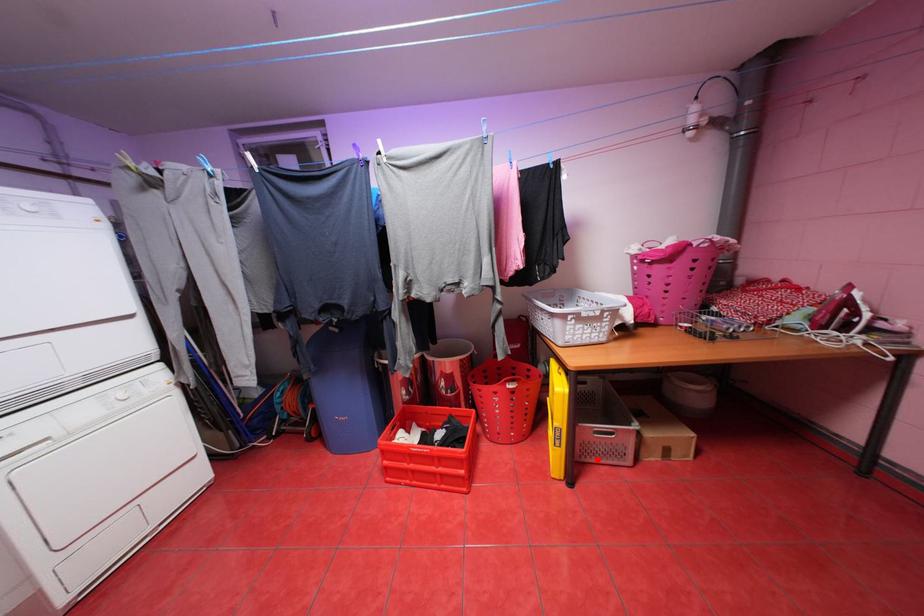
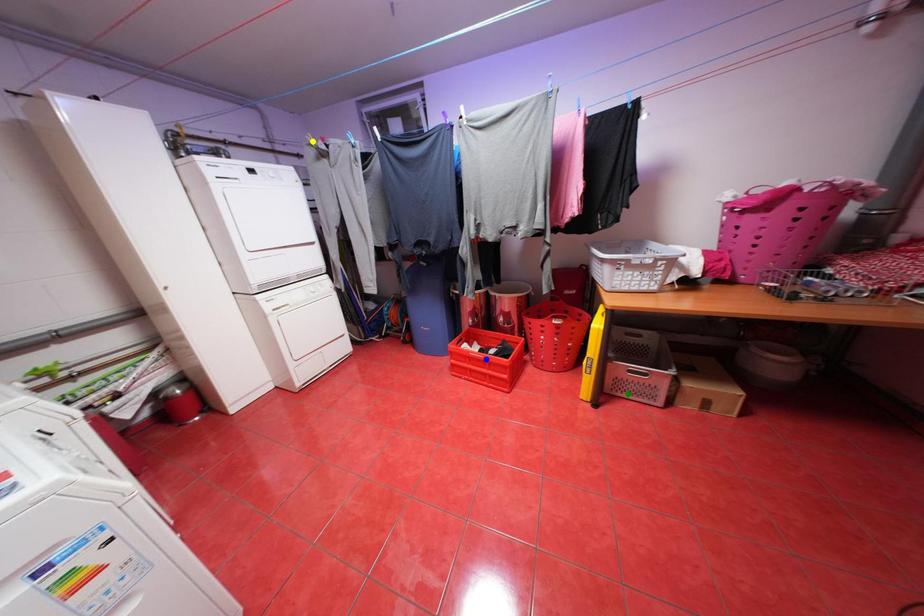
Question: I am providing you with two images of the same scene from different viewpoints. A red point is marked on the first image. You are given multiple points on the second image. Which spot in image 2 lines up with the point in image 1?

Choices:
 (A) blue point
 (B) yellow point
 (C) green point

Answer: (C)